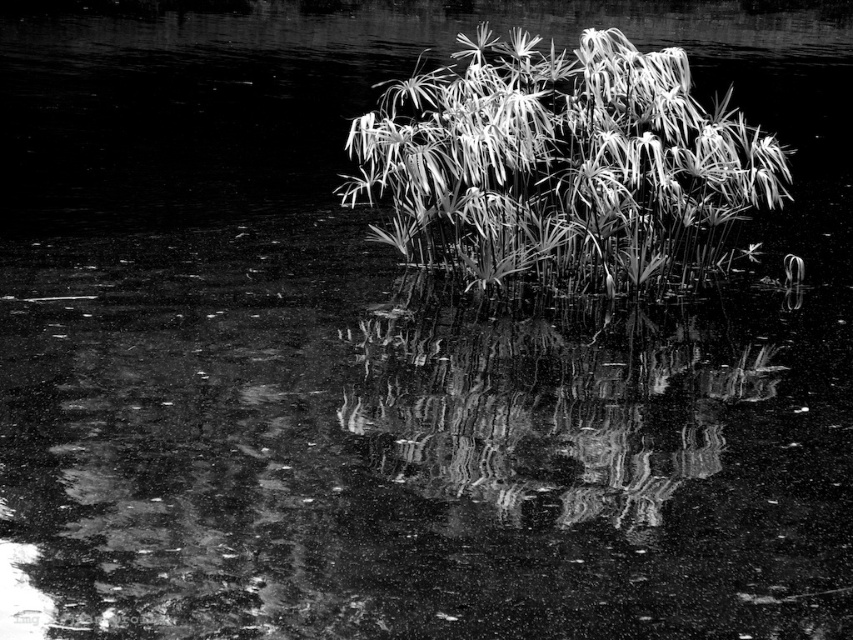
Question: Is silvery metallic plant at center below smooth reflective water at center?

Choices:
 (A) yes
 (B) no

Answer: (B)

Question: Does silvery metallic plant at center have a smaller size compared to smooth reflective water at center?

Choices:
 (A) yes
 (B) no

Answer: (A)

Question: Which point is farther from the camera taking this photo?

Choices:
 (A) (547, 480)
 (B) (503, 257)

Answer: (B)

Question: Which point appears closest to the camera in this image?

Choices:
 (A) (664, 214)
 (B) (683, 406)

Answer: (B)

Question: Does silvery metallic plant at center come in front of smooth reflective water at center?

Choices:
 (A) yes
 (B) no

Answer: (B)